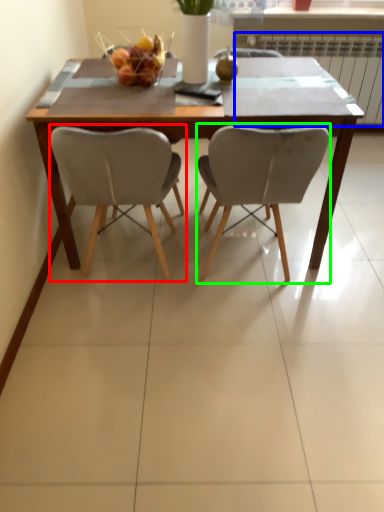
Question: Estimate the real-world distances between objects in this image. Which object is farther from chair (highlighted by a red box), radiator (highlighted by a blue box) or chair (highlighted by a green box)?

Choices:
 (A) radiator
 (B) chair

Answer: (A)